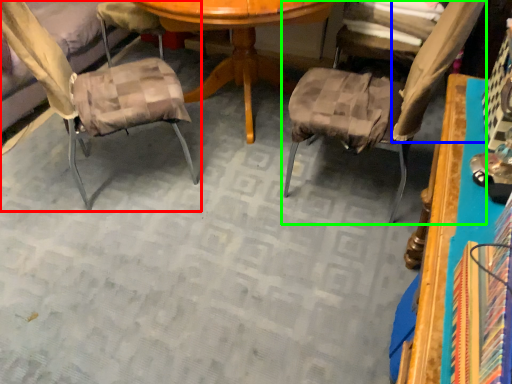
Question: Which object is positioned closest to chair (highlighted by a red box)? Select from fabric (highlighted by a blue box) and chair (highlighted by a green box).

Choices:
 (A) fabric
 (B) chair

Answer: (B)